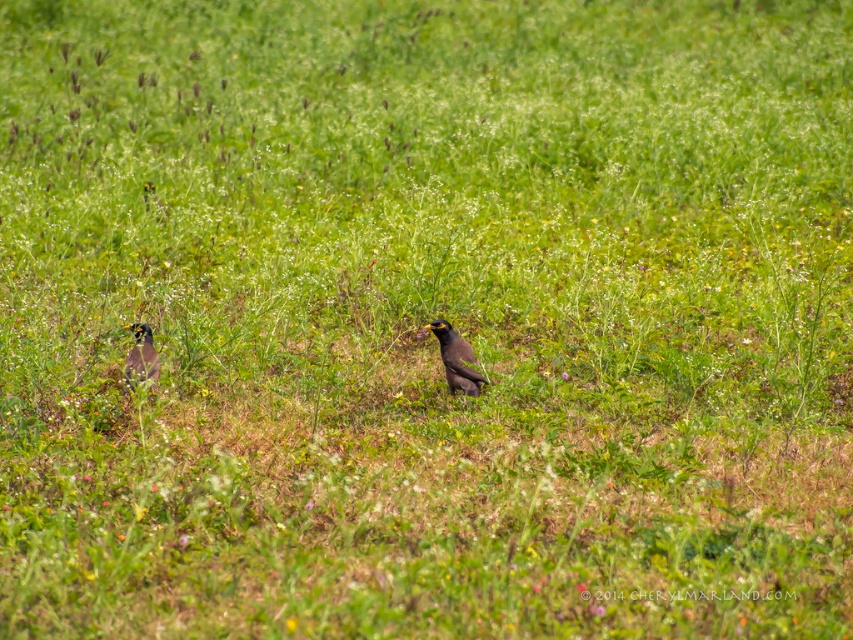
Can you confirm if brown speckled bird at center is wider than shiny black bird at left?

Yes, brown speckled bird at center is wider than shiny black bird at left.

Looking at this image, which is below, brown speckled bird at center or shiny black bird at left?

brown speckled bird at center is below.

Between point (469, 355) and point (138, 346), which one is positioned in front?

Positioned in front is point (138, 346).

This screenshot has width=853, height=640. Find the location of `brown speckled bird at center`. brown speckled bird at center is located at coordinates (456, 358).